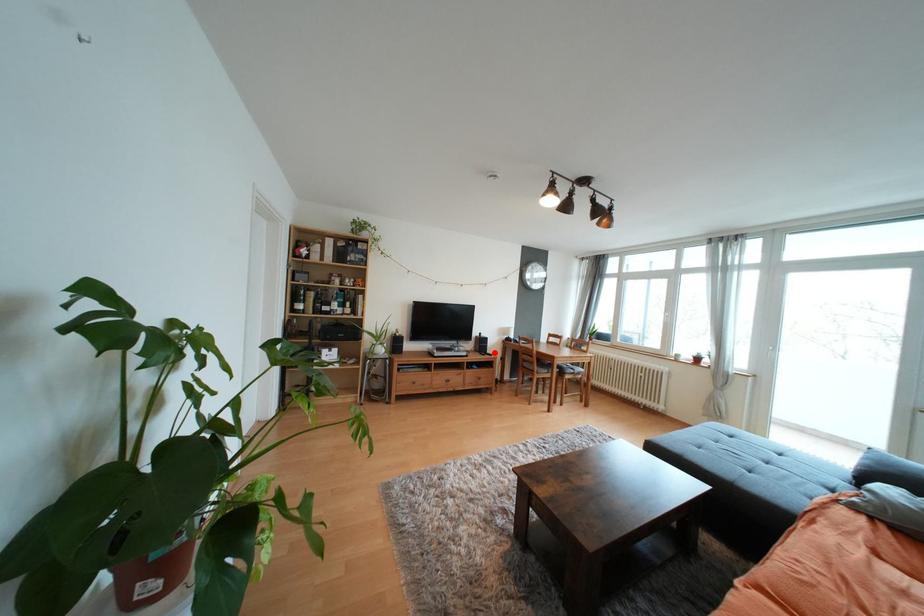
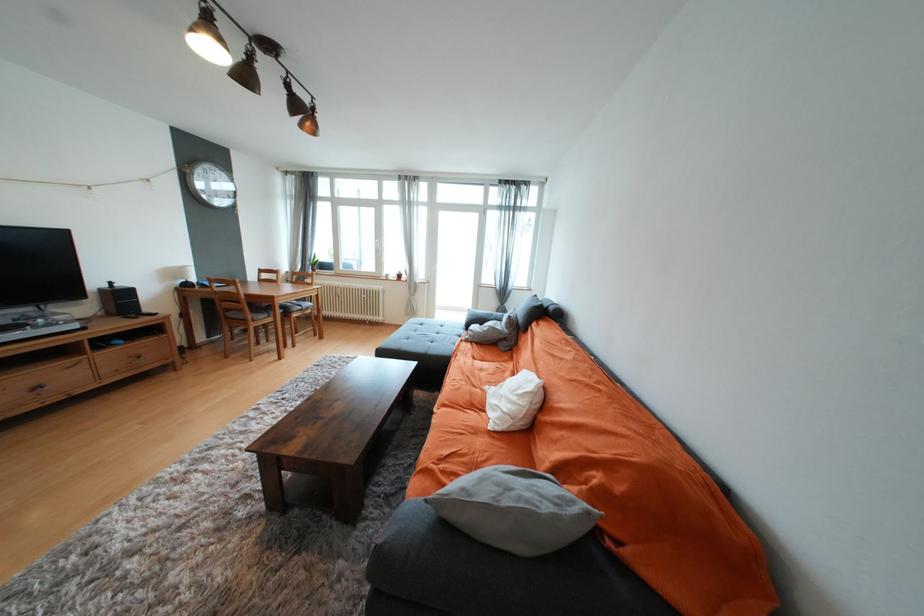
Locate, in the second image, the point that corresponds to the highlighted location in the first image.

(152, 312)